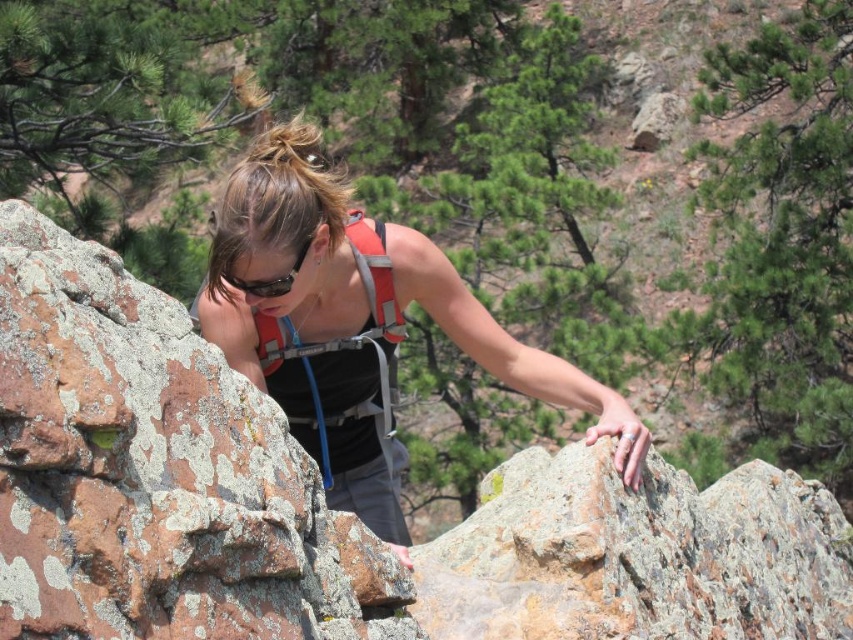
Which is behind, point (393, 525) or point (287, 358)?

Point (393, 525)

At what (x,y) coordinates should I click in order to perform the action: click on matte black tank top at center. Please return your answer as a coordinate pair (x, y). Looking at the image, I should click on (358, 324).

Does rusty rock at center come behind orange fabric vest at center?

No.

Does point (837, 628) lie behind point (349, 435)?

That is True.

I want to click on rusty rock at center, so click(x=637, y=556).

Does matte black tank top at center have a smaller size compared to black matte sunglasses at center?

Actually, matte black tank top at center might be larger than black matte sunglasses at center.

Between matte black tank top at center and black matte sunglasses at center, which one appears on the right side from the viewer's perspective?

From the viewer's perspective, matte black tank top at center appears more on the right side.

Which is behind, point (410, 243) or point (292, 264)?

The point (410, 243) is more distant.

You are a GUI agent. You are given a task and a screenshot of the screen. Output one action in this format:
    pyautogui.click(x=<x>, y=<y>)
    Task: Click on the matte black tank top at center
    This screenshot has width=853, height=640.
    Given the screenshot: What is the action you would take?
    [x=358, y=324]